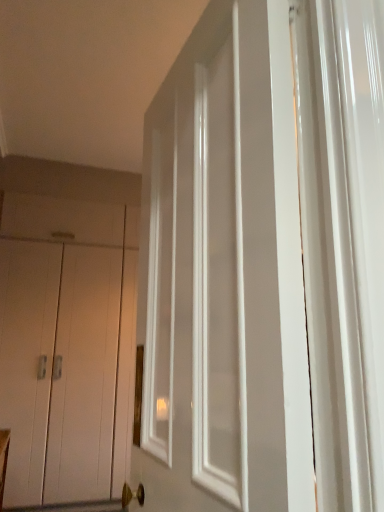
What is the approximate width of white glossy door at center?

The width of white glossy door at center is 41.68 centimeters.

The image size is (384, 512). Describe the element at coordinates (265, 263) in the screenshot. I see `white glossy door at center` at that location.

This screenshot has height=512, width=384. I want to click on white glossy door at center, so click(x=265, y=263).

Identify the location of white glossy door at center. This screenshot has height=512, width=384. (265, 263).